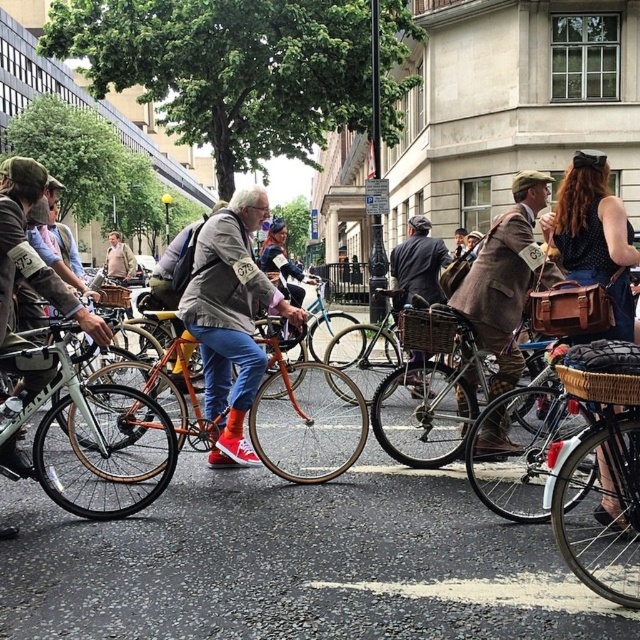
You are a photographer standing at point (230, 317). What is the most prominent clothing item visible at your exact location?

The most prominent clothing item at point (230, 317) is the matte beige jacket at center.

You are a photographer standing at the edge of the street. You want to take a photo that includes both the orange matte bicycle at center and the shiny silver bicycle at center. Which bicycle should you position to the right side in your camera frame to capture both?

To capture both the orange matte bicycle at center and the shiny silver bicycle at center in your photo, you should position the orange matte bicycle at center to the right side of the shiny silver bicycle at center in your camera frame, as it is already on the right side of the shiny silver bicycle at center in the scene.

You are a photographer positioned at the front of the scene. You want to take a photo of the brown woolen suit at center and the brown leather bag at right. Can you see both objects clearly in your frame without any obstruction?

The brown leather bag at right is behind the brown woolen suit at center, so it might be partially or fully obscured, making it difficult to see both clearly without moving the camera angle or adjusting the frame.